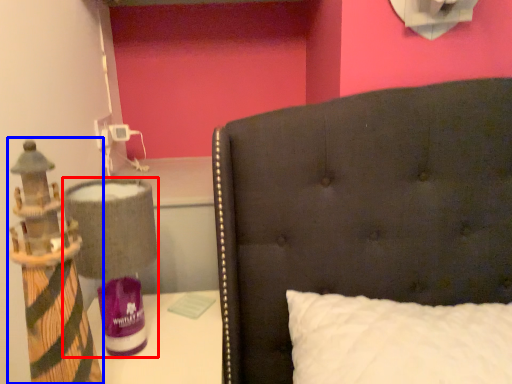
Question: Which object appears farthest to the camera in this image, table lamp (highlighted by a red box) or toy (highlighted by a blue box)?

Choices:
 (A) table lamp
 (B) toy

Answer: (A)